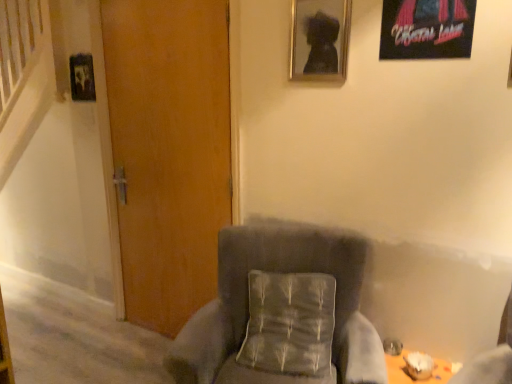
Question: Is velvet gray armchair at center outside of wooden door at center?

Choices:
 (A) no
 (B) yes

Answer: (B)

Question: Is velvet gray armchair at center wider than wooden door at center?

Choices:
 (A) no
 (B) yes

Answer: (B)

Question: From a real-world perspective, is velvet gray armchair at center positioned under wooden door at center based on gravity?

Choices:
 (A) no
 (B) yes

Answer: (B)

Question: Is the depth of velvet gray armchair at center less than that of wooden door at center?

Choices:
 (A) yes
 (B) no

Answer: (A)

Question: Is velvet gray armchair at center thinner than wooden door at center?

Choices:
 (A) yes
 (B) no

Answer: (B)

Question: Is velvet gray armchair at center bigger than wooden door at center?

Choices:
 (A) no
 (B) yes

Answer: (B)

Question: Is wooden door at center to the left of textured gray pillow at center from the viewer's perspective?

Choices:
 (A) yes
 (B) no

Answer: (A)

Question: Considering the relative sizes of wooden door at center and textured gray pillow at center in the image provided, is wooden door at center thinner than textured gray pillow at center?

Choices:
 (A) no
 (B) yes

Answer: (B)

Question: From a real-world perspective, does wooden door at center stand above textured gray pillow at center?

Choices:
 (A) yes
 (B) no

Answer: (A)

Question: From the image's perspective, is wooden door at center below textured gray pillow at center?

Choices:
 (A) yes
 (B) no

Answer: (B)

Question: Considering the relative sizes of wooden door at center and textured gray pillow at center in the image provided, is wooden door at center smaller than textured gray pillow at center?

Choices:
 (A) yes
 (B) no

Answer: (B)

Question: Is wooden door at center touching textured gray pillow at center?

Choices:
 (A) no
 (B) yes

Answer: (A)

Question: From the image's perspective, is metallic poster at upper right, the first picture frame positioned from the right, on matte black picture frame at upper center, which is the second picture frame from front to back?

Choices:
 (A) no
 (B) yes

Answer: (B)